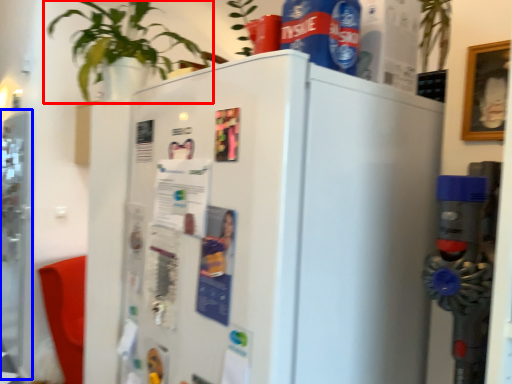
Question: Which object appears farthest to the camera in this image, houseplant (highlighted by a red box) or screen door (highlighted by a blue box)?

Choices:
 (A) houseplant
 (B) screen door

Answer: (B)